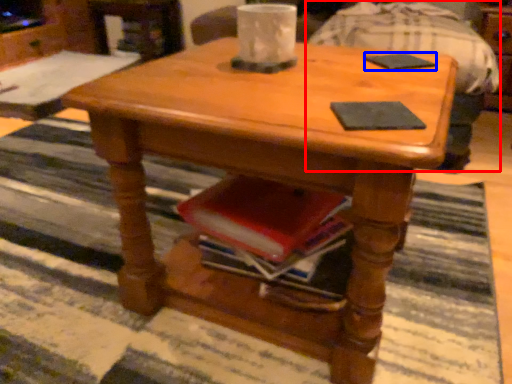
Question: Which of the following is the farthest to the observer, swivel chair (highlighted by a red box) or pad (highlighted by a blue box)?

Choices:
 (A) swivel chair
 (B) pad

Answer: (A)